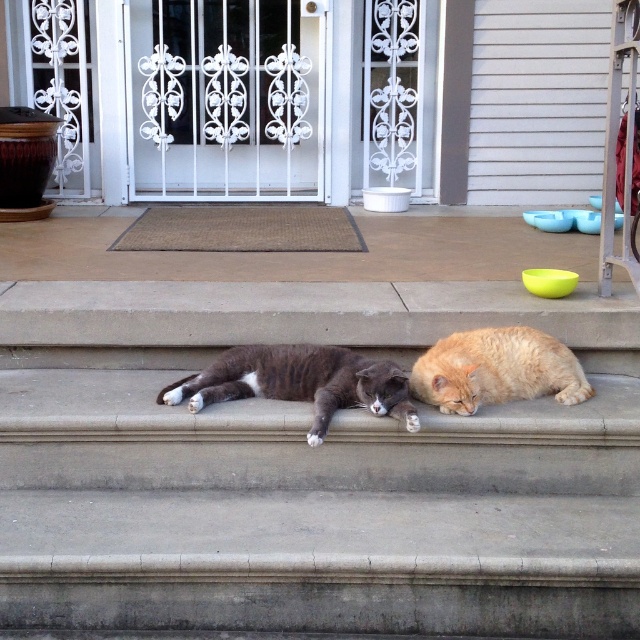
You are a delivery person approaching the porch. You see the gray striped cat at center and the orange fluffy cat at lower right. Which cat is closer to you as you approach the porch?

The gray striped cat at center is closer to you because it is positioned in front of the orange fluffy cat at lower right.

You are standing on the residential porch and want to place a small potted plant exactly at the point marked as point [300,381]. What object is currently located at that point?

The gray striped cat at center is located at point [300,381].

You are standing on the porch and want to step onto the concrete stairs at center. Which direction should you move relative to the orange fluffy cat at lower right?

You should move towards the concrete stairs at center, which are closer to you than the orange fluffy cat at lower right. Since the stairs are closer, you can step onto them without needing to move around the cat.